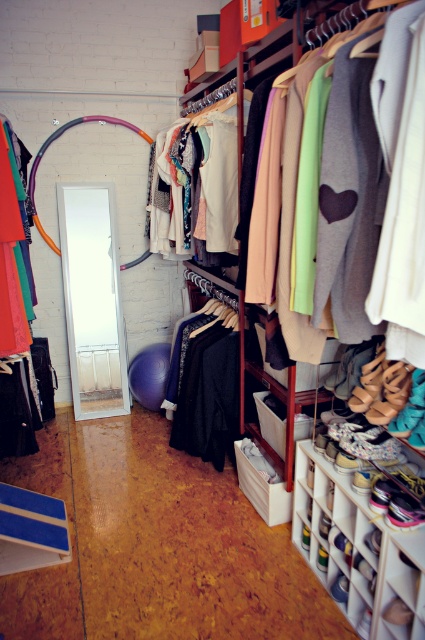
Which is in front, point (320, 577) or point (10, 200)?

Point (10, 200) is in front.

This screenshot has height=640, width=425. I want to click on matte fabric clothes at center, so (x=376, y=186).

Does matte fabric clothes at center appear on the left side of white plastic shoe rack at lower right?

Indeed, matte fabric clothes at center is positioned on the left side of white plastic shoe rack at lower right.

Is matte fabric clothes at center wider than white plastic shoe rack at lower right?

Indeed, matte fabric clothes at center has a greater width compared to white plastic shoe rack at lower right.

I want to click on matte fabric clothes at center, so click(x=376, y=186).

Locate an element on the screen. matte fabric clothes at center is located at coordinates (376, 186).

Who is shorter, white plastic shoe rack at lower right or matte orange fabric at left?

white plastic shoe rack at lower right is shorter.

Does white plastic shoe rack at lower right have a smaller size compared to matte orange fabric at left?

Incorrect, white plastic shoe rack at lower right is not smaller in size than matte orange fabric at left.

At what (x,y) coordinates should I click in order to perform the action: click on white plastic shoe rack at lower right. Please return your answer as a coordinate pair (x, y). Looking at the image, I should click on (357, 548).

The image size is (425, 640). Identify the location of white plastic shoe rack at lower right. (357, 548).